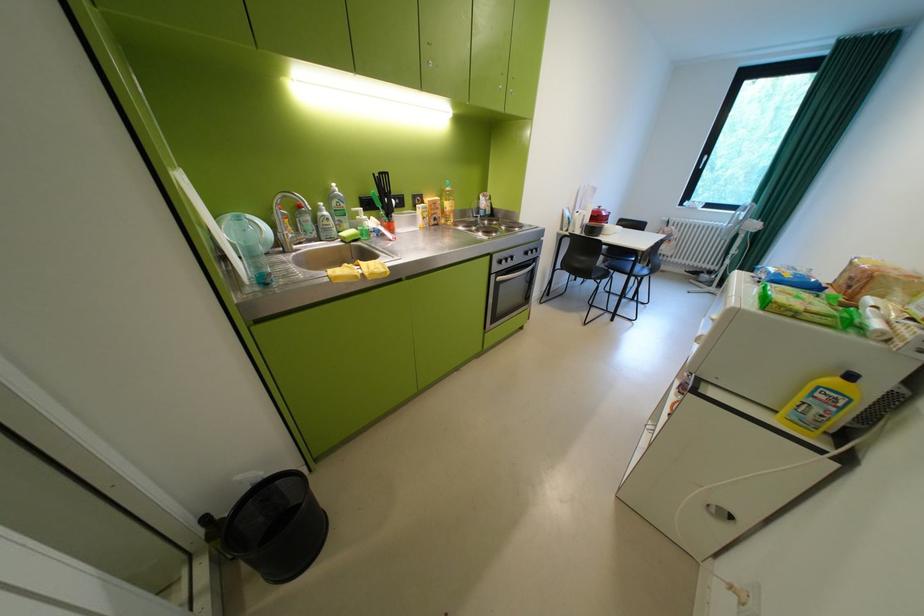
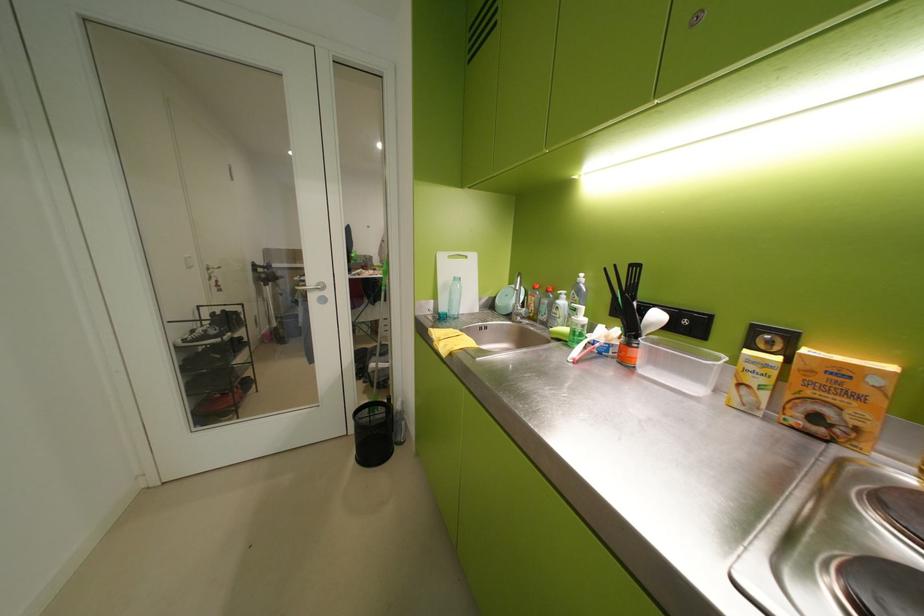
Locate, in the second image, the point that corresponds to pixel 424 198 in the first image.

(767, 331)